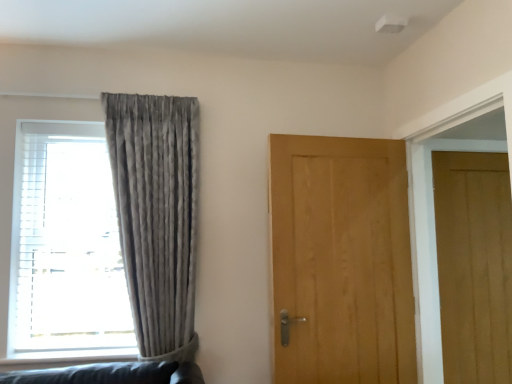
Question: Is light brown wood door at center, placed as the 1th door when sorted from left to right, to the left or to the right of matte gray curtain at left in the image?

Choices:
 (A) left
 (B) right

Answer: (B)

Question: Is light brown wood door at center, positioned as the 1th door in front-to-back order, wider or thinner than matte gray curtain at left?

Choices:
 (A) thin
 (B) wide

Answer: (A)

Question: Estimate the real-world distances between objects in this image. Which object is farther from the light brown wood door at center, placed as the 1th door when sorted from left to right?

Choices:
 (A) matte gray curtain at left
 (B) light brown wood door at right, which is the second door in left-to-right order
 (C) satin grey curtain at left

Answer: (A)

Question: Estimate the real-world distances between objects in this image. Which object is closer to the light brown wood door at center, positioned as the 1th door in front-to-back order?

Choices:
 (A) light brown wood door at right, the second door positioned from the front
 (B) satin grey curtain at left
 (C) matte gray curtain at left

Answer: (A)